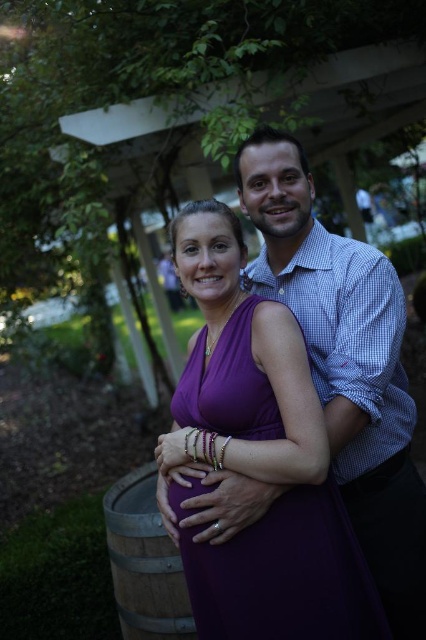
Which is behind, point (279, 525) or point (129, 541)?

Point (129, 541)

Is point (195, 372) behind point (173, 636)?

No.

At what (x,y) coordinates should I click in order to perform the action: click on purple satin dress at center. Please return your answer as a coordinate pair (x, y). Looking at the image, I should click on pos(285,576).